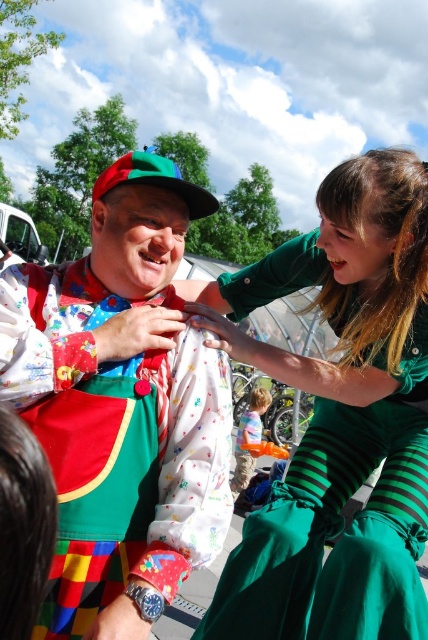
Is floral fabric clown outfit at center to the right of green striped dress at center from the viewer's perspective?

Incorrect, floral fabric clown outfit at center is not on the right side of green striped dress at center.

Can you confirm if floral fabric clown outfit at center is shorter than green striped dress at center?

Correct, floral fabric clown outfit at center is not as tall as green striped dress at center.

Where is `floral fabric clown outfit at center`? The image size is (428, 640). floral fabric clown outfit at center is located at coordinates (121, 406).

Identify the location of floral fabric clown outfit at center. (121, 406).